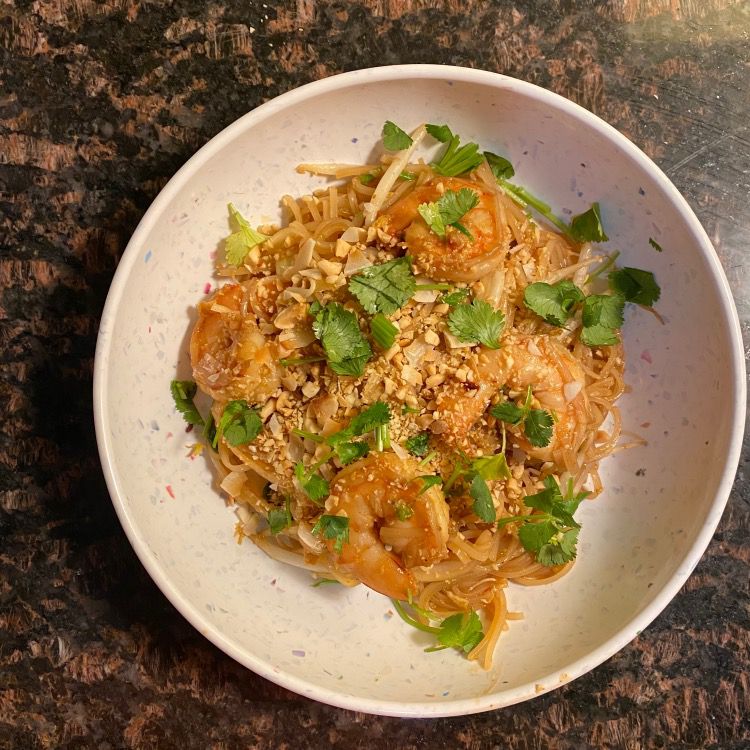
The width and height of the screenshot is (750, 750). Find the location of `granite tabletop lower right`. granite tabletop lower right is located at coordinates (682, 679).